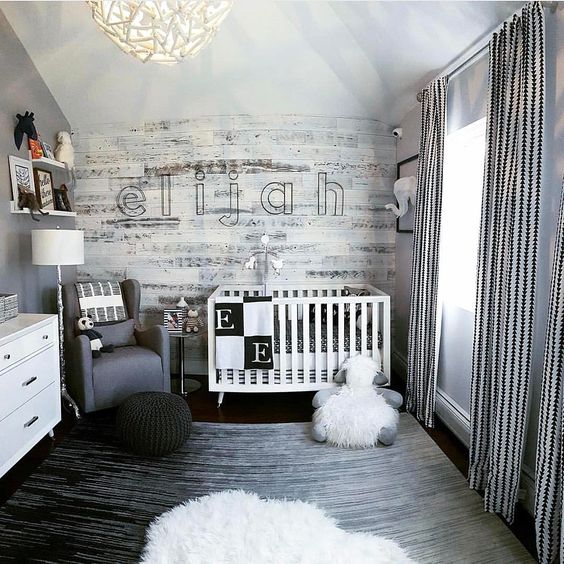
I want to click on fur rug, so click(233, 553).